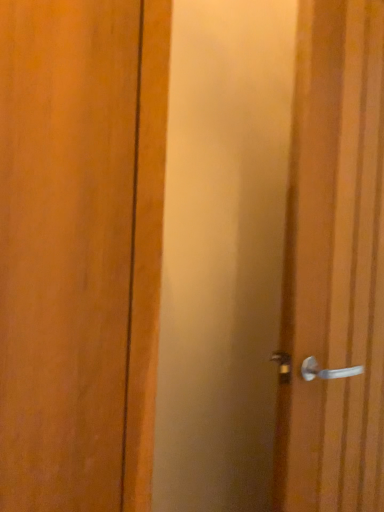
The image size is (384, 512). Identify the location of wooden door handle at right. [334, 265].

This screenshot has height=512, width=384. What do you see at coordinates (334, 265) in the screenshot?
I see `wooden door handle at right` at bounding box center [334, 265].

The image size is (384, 512). Find the location of `wooden door handle at right`. wooden door handle at right is located at coordinates (334, 265).